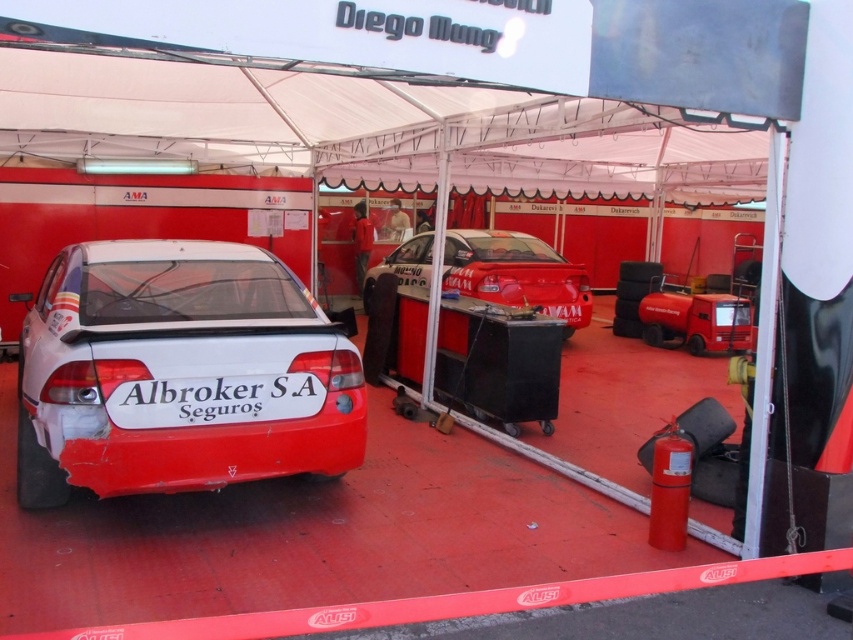
Consider the image. Can you confirm if white glossy car at center is thinner than glossy white car at center?

Incorrect, white glossy car at center's width is not less than glossy white car at center's.

This screenshot has width=853, height=640. I want to click on white glossy car at center, so click(180, 372).